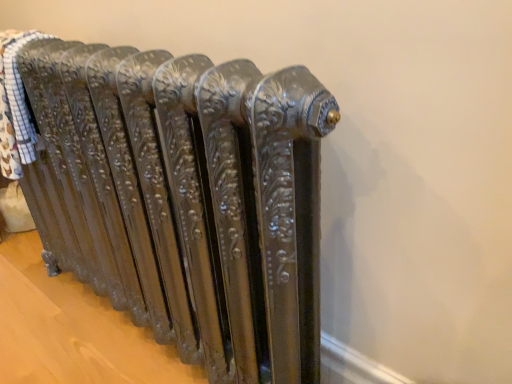
What do you see at coordinates (15, 106) in the screenshot? I see `fluffy cotton blanket at left` at bounding box center [15, 106].

Measure the distance between fluffy cotton blanket at left and camera.

A distance of 33.99 inches exists between fluffy cotton blanket at left and camera.

The image size is (512, 384). In order to click on fluffy cotton blanket at left in this screenshot , I will do `click(15, 106)`.

You are a GUI agent. You are given a task and a screenshot of the screen. Output one action in this format:
    pyautogui.click(x=<x>, y=<y>)
    Task: Click on the fluffy cotton blanket at left
    
    Given the screenshot: What is the action you would take?
    click(15, 106)